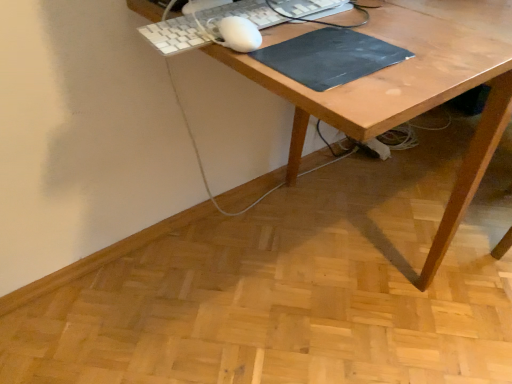
At what (x,y) coordinates should I click in order to perform the action: click on vacant space in black matte mousepad at center (from a real-world perspective). Please return your answer as a coordinate pair (x, y). Looking at the image, I should click on (330, 52).